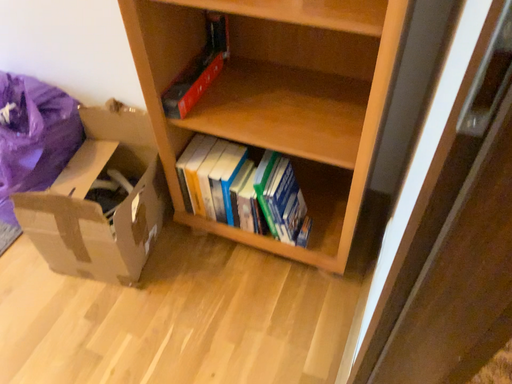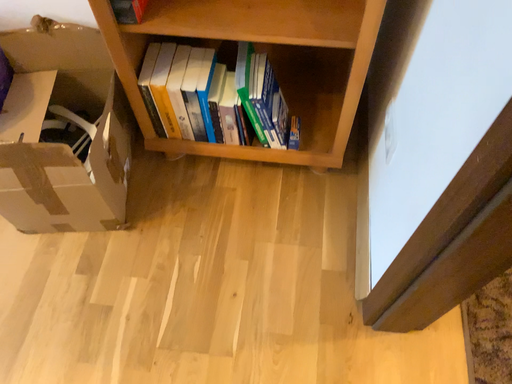
Question: Which way did the camera rotate in the video?

Choices:
 (A) rotated left
 (B) rotated right

Answer: (B)